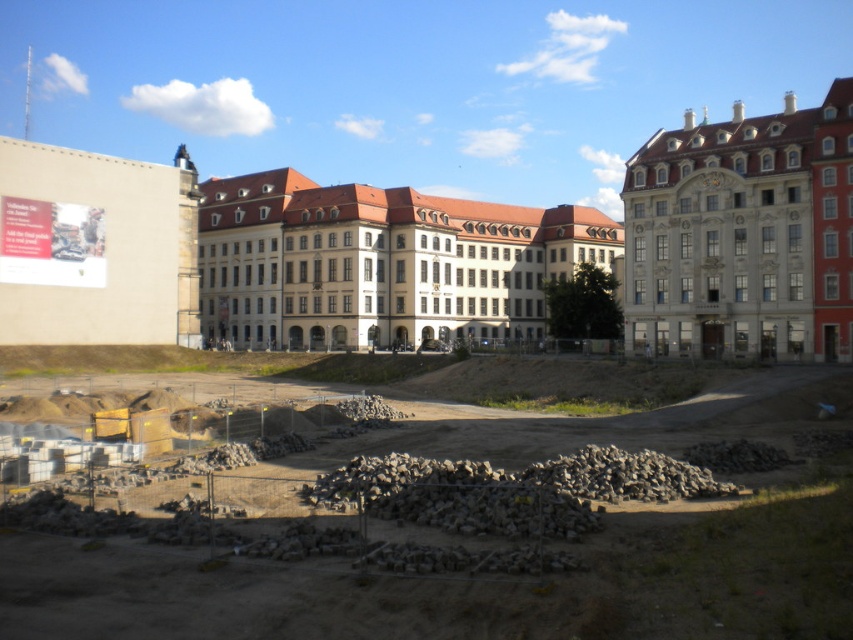
Which is more to the left, gray gravel pile at center or white stone building at center?

white stone building at center

From the picture: Is gray gravel pile at center below white stone building at center?

Yes, gray gravel pile at center is below white stone building at center.

Between point (47, 560) and point (212, 227), which one is positioned in front?

Point (47, 560)

Where is `gray gravel pile at center`? The width and height of the screenshot is (853, 640). gray gravel pile at center is located at coordinates (x=462, y=582).

Can you confirm if white stone building at center is smaller than white stone building at upper right?

Yes.

Between point (560, 244) and point (714, 348), which one is positioned in front?

Point (714, 348)

This screenshot has height=640, width=853. I want to click on white stone building at center, so click(380, 262).

Which is above, gray gravel pile at center or white stone building at upper right?

white stone building at upper right is higher up.

Can you confirm if gray gravel pile at center is smaller than white stone building at upper right?

Yes, gray gravel pile at center is smaller than white stone building at upper right.

Between point (233, 522) and point (671, 349), which one is positioned in front?

Point (233, 522) is more forward.

I want to click on gray gravel pile at center, so click(x=462, y=582).